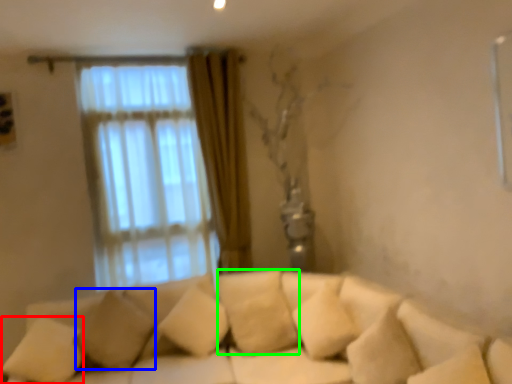
Question: Which object is positioned farthest from pillow (highlighted by a red box)? Select from pillow (highlighted by a blue box) and pillow (highlighted by a green box).

Choices:
 (A) pillow
 (B) pillow

Answer: (B)